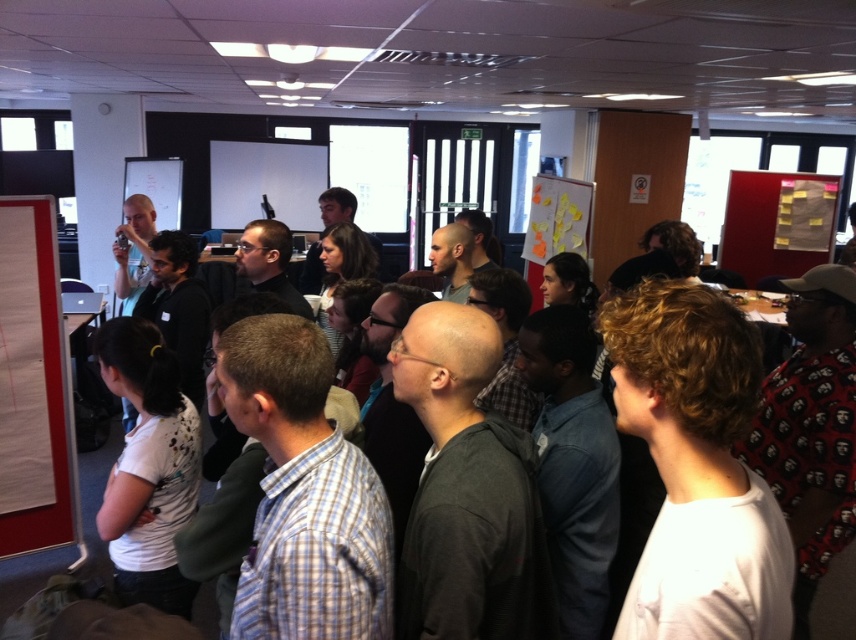
Question: Does white matte shirt at lower left appear on the right side of white paper at left?

Choices:
 (A) no
 (B) yes

Answer: (B)

Question: Which of the following is the closest to the observer?

Choices:
 (A) white paper at left
 (B) white matte shirt at lower left

Answer: (B)

Question: Which object appears closest to the camera in this image?

Choices:
 (A) white paper at left
 (B) white matte shirt at lower left

Answer: (B)

Question: Considering the relative positions of white matte shirt at lower left and white paper at left in the image provided, where is white matte shirt at lower left located with respect to white paper at left?

Choices:
 (A) below
 (B) above

Answer: (A)

Question: Which object is closer to the camera taking this photo?

Choices:
 (A) white paper at left
 (B) white matte shirt at lower left

Answer: (B)

Question: Can you confirm if white matte shirt at lower left is positioned above white paper at left?

Choices:
 (A) yes
 (B) no

Answer: (B)